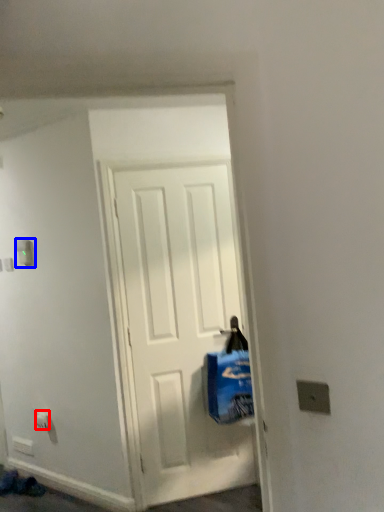
Question: Which point is closer to the camera, electric outlet (highlighted by a red box) or light switch (highlighted by a blue box)?

Choices:
 (A) electric outlet
 (B) light switch

Answer: (B)